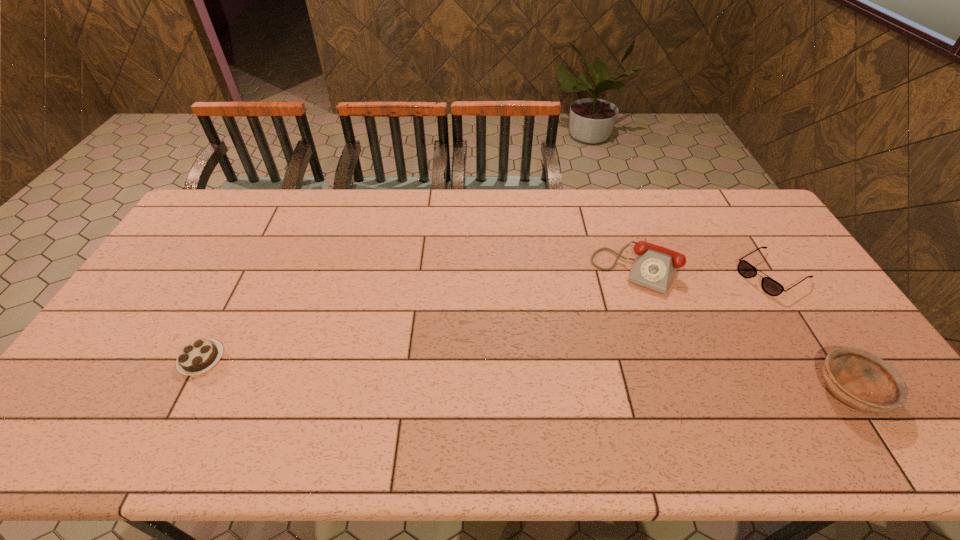
You are a GUI agent. You are given a task and a screenshot of the screen. Output one action in this format:
    pyautogui.click(x=<x>, y=<y>)
    Task: Click on the vacant space situated 0.160m on the dial of the tallest object
    Image resolution: width=960 pixels, height=540 pixels.
    Given the screenshot: What is the action you would take?
    pyautogui.click(x=606, y=330)

Find the location of `blank space located 0.220m on the front-facing side of the second shortest object`. blank space located 0.220m on the front-facing side of the second shortest object is located at coordinates click(701, 317).

This screenshot has width=960, height=540. Identify the location of vacant space located on the front-facing side of the second shortest object. (664, 340).

Locate an element on the screen. This screenshot has height=540, width=960. vacant space situated on the front-facing side of the second shortest object is located at coordinates (682, 329).

Find the location of a particular element. This screenshot has height=540, width=960. chocolate cake that is positioned at the near edge is located at coordinates (198, 356).

Find the location of a particular element. bowl that is at the near edge is located at coordinates (860, 379).

Locate an element on the screen. Image resolution: width=960 pixels, height=540 pixels. bowl situated at the right edge is located at coordinates (860, 379).

At what (x,y) coordinates should I click in order to perform the action: click on spectacles that is at the right edge. Please return your answer as a coordinate pair (x, y). Looking at the image, I should click on (745, 269).

Find the location of `object at the near right corner`. object at the near right corner is located at coordinates (860, 379).

The image size is (960, 540). I want to click on vacant space at the far edge of the desktop, so click(545, 210).